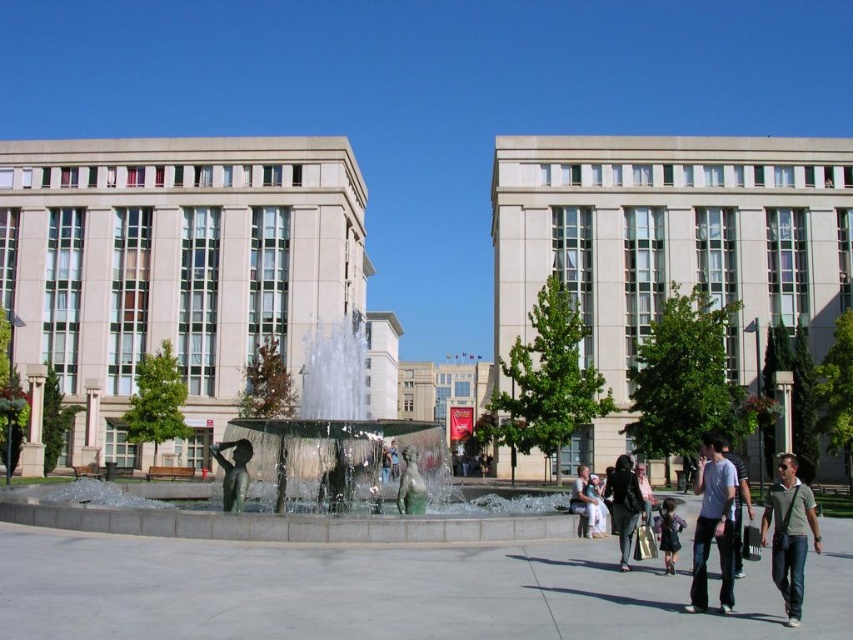
Question: Which object is the closest to the light blue denim jeans at lower right?

Choices:
 (A) bronze statue at center
 (B) light brown leather jacket at lower center
 (C) black fabric jacket at lower right
 (D) gray cotton t-shirt at lower right

Answer: (D)

Question: Does dark blue denim jeans at lower right appear under light brown leather jacket at lower center?

Choices:
 (A) no
 (B) yes

Answer: (A)

Question: Does polished bronze statue at center appear on the right side of light brown leather jacket at lower center?

Choices:
 (A) yes
 (B) no

Answer: (B)

Question: Which point is closer to the camera?

Choices:
 (A) (666, 509)
 (B) (706, 554)

Answer: (B)

Question: Considering the relative positions of gray cotton t-shirt at lower right and black fabric jacket at lower right in the image provided, where is gray cotton t-shirt at lower right located with respect to black fabric jacket at lower right?

Choices:
 (A) left
 (B) right

Answer: (B)

Question: Which object is closer to the camera taking this photo?

Choices:
 (A) black fabric jacket at lower right
 (B) bronze statue at center

Answer: (A)